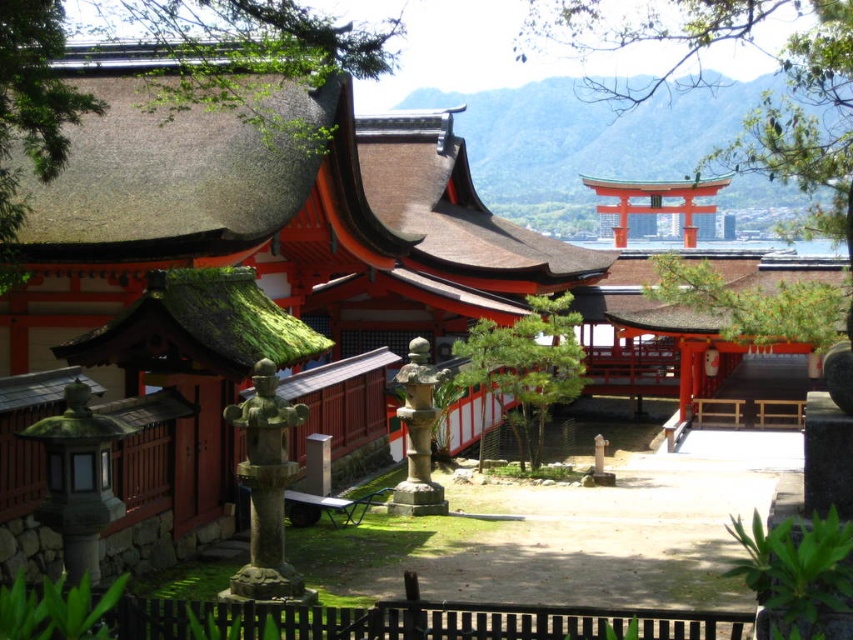
You are standing at the entrance of the shrine and want to take a photo of the green textured pine tree at center. The camera you are using has a maximum focus range of 10 meters. Will the tree be in focus?

The green textured pine tree at center is 11.06 meters from camera, which exceeds the camera maximum focus range of 10 meters. Therefore, the tree will not be in focus.

You are a visitor at the Shinto shrine and want to place a small offering on the green textured stone at center. However, you notice there is also a green textured pine tree at center nearby. Which object is taller, allowing you to easily place your offering without it being obscured by the other?

The green textured stone at center is much taller than the green textured pine tree at center, so placing the offering on the stone will ensure it is not obscured by the pine tree.

You are a visitor at the Shinto shrine and want to take a photo of the green textured pine tree at center and the stone lantern at center. Which object should you focus on first if you want to capture both in a single frame without moving the camera?

The green textured pine tree at center is bigger than the stone lantern at center, so you should focus on the green textured pine tree at center first to ensure it fits properly in the frame before adjusting for the smaller stone lantern at center.